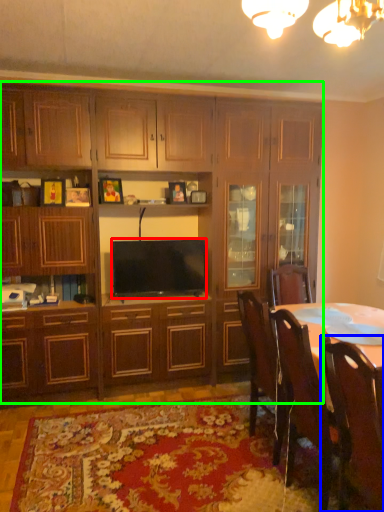
Question: Which is nearer to the television (highlighted by a red box)? chair (highlighted by a blue box) or cabinetry (highlighted by a green box).

Choices:
 (A) chair
 (B) cabinetry

Answer: (B)